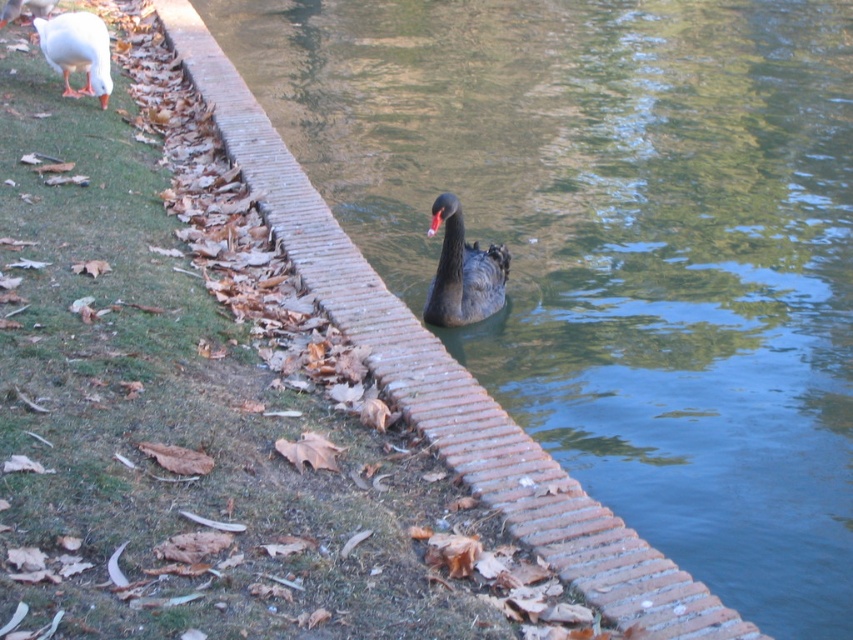
You are a photographer trying to capture both the shiny black swan at center and the white matte duck at upper left in a single frame. Given their sizes, which bird should you focus on first to ensure both fit in the photo?

Answer: The shiny black swan at center is bigger than the white matte duck at upper left, so you should focus on the shiny black swan at center first to ensure it fits in the frame, allowing space for the smaller duck.

You are a photographer trying to capture both the shiny black swan at center and the white matte duck at upper left in the same frame. Which object will appear wider in your photo?

The white matte duck at upper left will appear wider in the photo because the shiny black swan at center has a smaller width than the white matte duck at upper left according to the description.

You are a bird that wants to land on the brick at center and the shiny black swan at center. Which surface is wider for landing?

The shiny black swan at center is wider than the brick at center, so it would provide a wider landing surface.